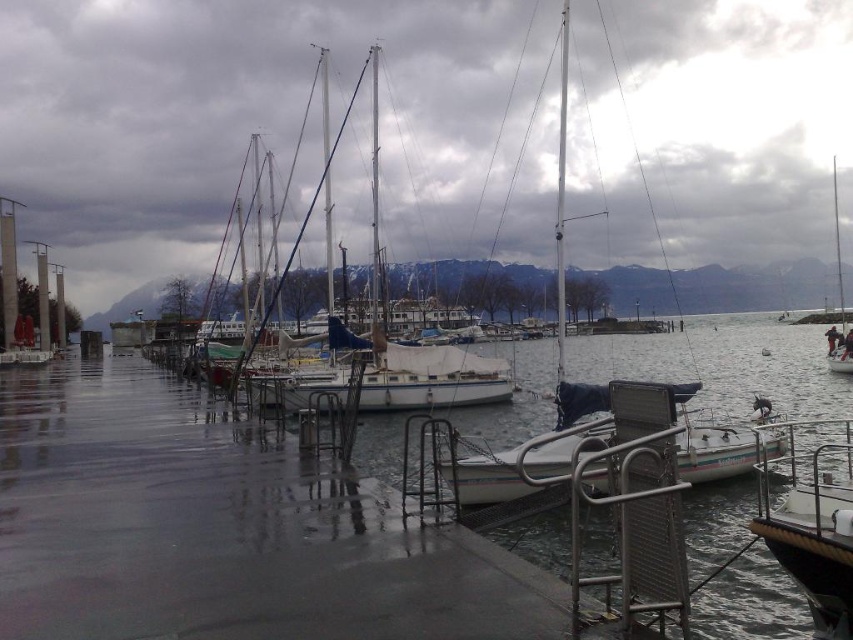
Is clear water at dock center bigger than black matte boat at lower right?

Indeed, clear water at dock center has a larger size compared to black matte boat at lower right.

Which of these two, clear water at dock center or black matte boat at lower right, stands shorter?

Standing shorter between the two is clear water at dock center.

Between point (474, 563) and point (824, 522), which one is positioned in front?

Point (474, 563) is in front.

Where is `clear water at dock center`? This screenshot has height=640, width=853. clear water at dock center is located at coordinates (202, 528).

Can you confirm if white matte sailboat at center is thinner than clear water at dock center?

In fact, white matte sailboat at center might be wider than clear water at dock center.

Between point (801, 40) and point (451, 618), which one is positioned behind?

Point (801, 40)

Where is `white matte sailboat at center`? This screenshot has width=853, height=640. white matte sailboat at center is located at coordinates (250, 118).

Between white matte sailboat at center and white matte boat at center, which one is positioned higher?

Positioned higher is white matte sailboat at center.

Is point (735, 216) more distant than point (624, 435)?

Yes, it is behind point (624, 435).

Between point (706, 83) and point (706, 448), which one is positioned in front?

Point (706, 448)

Locate an element on the screen. white matte sailboat at center is located at coordinates (250, 118).